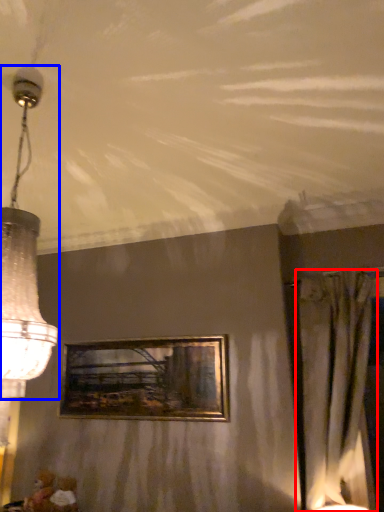
Question: Which of the following is the farthest to the observer, curtain (highlighted by a red box) or lamp (highlighted by a blue box)?

Choices:
 (A) curtain
 (B) lamp

Answer: (A)